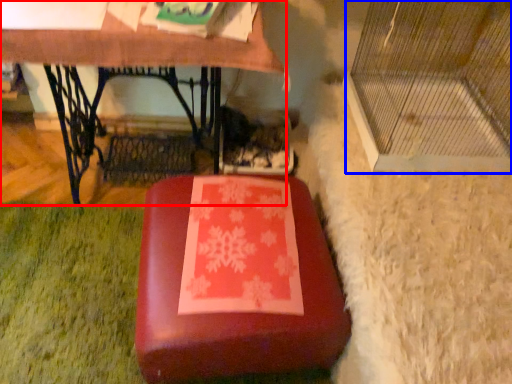
Question: Which of the following is the farthest to the observer, table (highlighted by a red box) or glass door (highlighted by a blue box)?

Choices:
 (A) table
 (B) glass door

Answer: (A)